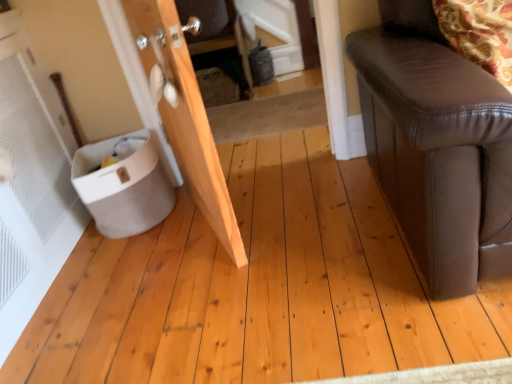
This screenshot has width=512, height=384. What do you see at coordinates (123, 185) in the screenshot? I see `white fabric potty at lower left` at bounding box center [123, 185].

Image resolution: width=512 pixels, height=384 pixels. What are the coordinates of `white fabric potty at lower left` in the screenshot? It's located at (123, 185).

Measure the distance between point (178, 45) and camera.

Point (178, 45) is 1.21 meters from camera.

What do you see at coordinates (186, 118) in the screenshot? I see `natural wood door at left` at bounding box center [186, 118].

Find the location of a particular element. This screenshot has height=384, width=512. natural wood door at left is located at coordinates (186, 118).

Where is `white fabric potty at lower left`? This screenshot has width=512, height=384. white fabric potty at lower left is located at coordinates (123, 185).

Considering the positions of objects natural wood door at left and white fabric potty at lower left in the image provided, who is more to the right, natural wood door at left or white fabric potty at lower left?

From the viewer's perspective, natural wood door at left appears more on the right side.

Who is more distant, natural wood door at left or white fabric potty at lower left?

white fabric potty at lower left is further away from the camera.

Considering the positions of point (196, 89) and point (142, 164), is point (196, 89) closer or farther from the camera than point (142, 164)?

Clearly, point (196, 89) is closer to the camera than point (142, 164).

Based on the photo, from the image's perspective, is natural wood door at left below white fabric potty at lower left?

Incorrect, from the image's perspective, natural wood door at left is higher than white fabric potty at lower left.

From a real-world perspective, is natural wood door at left below white fabric potty at lower left?

Actually, natural wood door at left is physically above white fabric potty at lower left in the real world.

In the scene shown: Is natural wood door at left wider or thinner than white fabric potty at lower left?

Clearly, natural wood door at left has less width compared to white fabric potty at lower left.

Considering the relative sizes of natural wood door at left and white fabric potty at lower left in the image provided, is natural wood door at left taller than white fabric potty at lower left?

Yes, natural wood door at left is taller than white fabric potty at lower left.

Can you confirm if natural wood door at left is bigger than white fabric potty at lower left?

Yes.

Is natural wood door at left inside or outside of white fabric potty at lower left?

The correct answer is: outside.

Is natural wood door at left next to white fabric potty at lower left and touching it?

They are not placed beside each other.

Could you tell me if natural wood door at left is facing white fabric potty at lower left?

Yes, natural wood door at left is aimed at white fabric potty at lower left.

How different are the orientations of natural wood door at left and white fabric potty at lower left in degrees?

There is a 89.4-degree angle between the facing directions of natural wood door at left and white fabric potty at lower left.

Locate an element on the screen. The image size is (512, 384). door lying on the right of white fabric potty at lower left is located at coordinates [x=186, y=118].

Between white fabric potty at lower left and natural wood door at left, which one appears on the right side from the viewer's perspective?

Positioned to the right is natural wood door at left.

Which is behind, white fabric potty at lower left or natural wood door at left?

white fabric potty at lower left is further from the camera.

Which is behind, point (123, 164) or point (170, 114)?

The point (123, 164) is behind.

From the image's perspective, which one is positioned lower, white fabric potty at lower left or natural wood door at left?

white fabric potty at lower left is shown below in the image.

Based on the photo, from a real-world perspective, between white fabric potty at lower left and natural wood door at left, who is vertically higher?

From a 3D spatial view, natural wood door at left is above.

Is white fabric potty at lower left thinner than natural wood door at left?

No, white fabric potty at lower left is not thinner than natural wood door at left.

Considering the relative sizes of white fabric potty at lower left and natural wood door at left in the image provided, is white fabric potty at lower left shorter than natural wood door at left?

Yes.

Considering the sizes of white fabric potty at lower left and natural wood door at left in the image, is white fabric potty at lower left bigger or smaller than natural wood door at left?

Clearly, white fabric potty at lower left is smaller in size than natural wood door at left.

Is white fabric potty at lower left not within natural wood door at left?

white fabric potty at lower left lies outside natural wood door at left's area.

Is the surface of white fabric potty at lower left in direct contact with natural wood door at left?

No, white fabric potty at lower left is not making contact with natural wood door at left.

Is white fabric potty at lower left facing away from natural wood door at left?

That's not correct — white fabric potty at lower left is not looking away from natural wood door at left.

How many degrees apart are the facing directions of white fabric potty at lower left and natural wood door at left?

The angle between the facing direction of white fabric potty at lower left and the facing direction of natural wood door at left is 89.4 degrees.

Where is `potty that appears below the natural wood door at left (from a real-world perspective)`? This screenshot has height=384, width=512. potty that appears below the natural wood door at left (from a real-world perspective) is located at coordinates pos(123,185).

At what (x,y) coordinates should I click in order to perform the action: click on potty that appears behind the natural wood door at left. Please return your answer as a coordinate pair (x, y). The height and width of the screenshot is (384, 512). Looking at the image, I should click on (123, 185).

Find the location of a particular element. door that is in front of the white fabric potty at lower left is located at coordinates (186, 118).